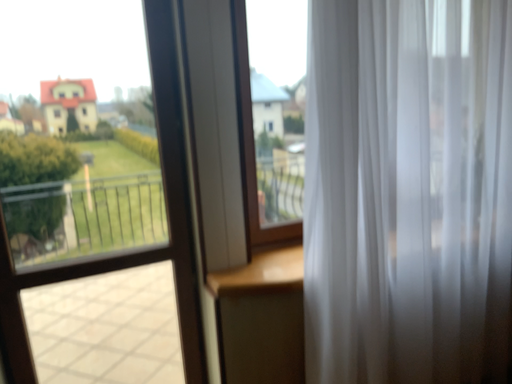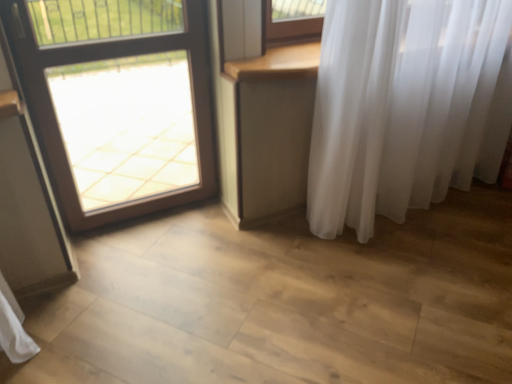
Question: Which way did the camera rotate in the video?

Choices:
 (A) rotated upward
 (B) rotated downward

Answer: (B)